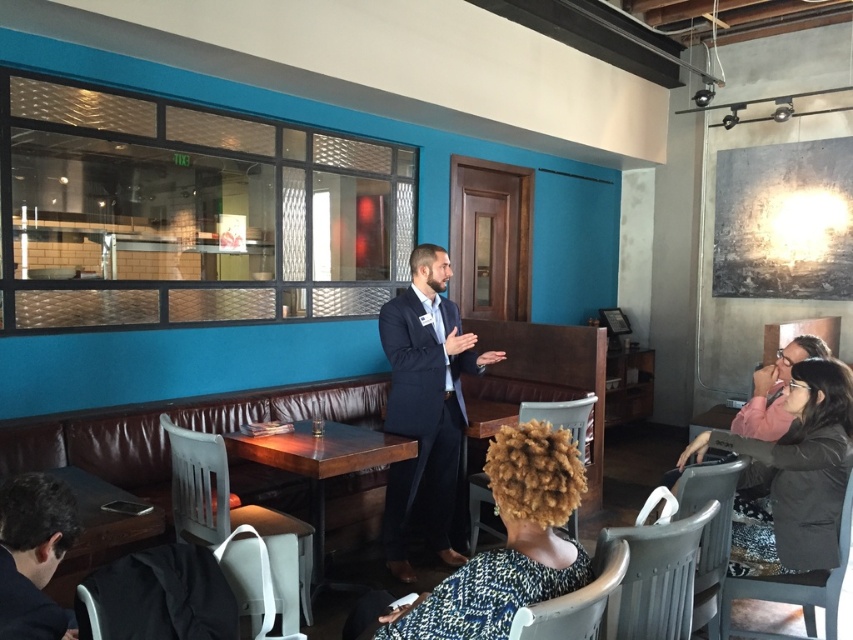
Who is more distant from viewer, (10, 509) or (328, 451)?

Positioned behind is point (328, 451).

In order to click on dark brown leather jacket at lower left in this screenshot , I will do `click(33, 556)`.

Find the location of `dark brown leather jacket at lower left`. dark brown leather jacket at lower left is located at coordinates (33, 556).

Is black matte jacket at lower right smaller than wooden table at center?

Correct, black matte jacket at lower right occupies less space than wooden table at center.

Is black matte jacket at lower right taller than wooden table at center?

Yes.

Find the location of a particular element. This screenshot has height=640, width=853. black matte jacket at lower right is located at coordinates (791, 476).

Locate an element on the screen. black matte jacket at lower right is located at coordinates (791, 476).

Is point (519, 580) farther from camera compared to point (30, 513)?

No, (519, 580) is in front of (30, 513).

Is curly blonde hair at center thinner than dark brown leather jacket at lower left?

No, curly blonde hair at center is not thinner than dark brown leather jacket at lower left.

Does point (451, 611) come closer to viewer compared to point (28, 637)?

That is False.

Identify the location of curly blonde hair at center. (508, 544).